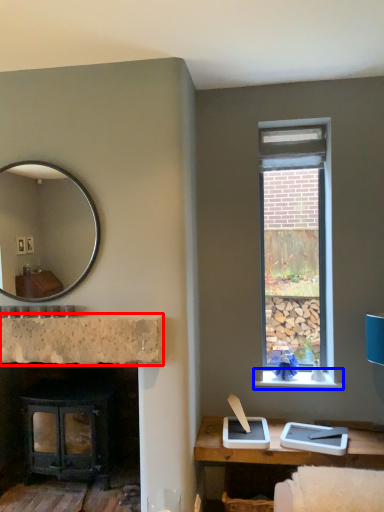
Question: Which point is further to the camera, counter top (highlighted by a red box) or window sill (highlighted by a blue box)?

Choices:
 (A) counter top
 (B) window sill

Answer: (B)